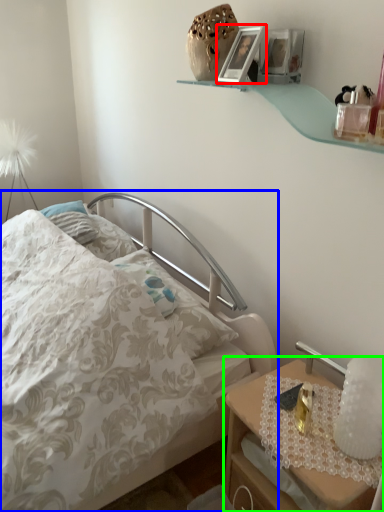
Question: Which object is positioned farthest from picture frame (highlighted by a red box)? Select from bed (highlighted by a blue box) and nightstand (highlighted by a green box).

Choices:
 (A) bed
 (B) nightstand

Answer: (B)